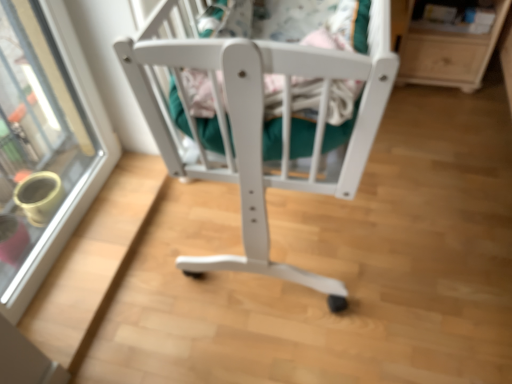
Question: Is transparent glass door at upper left inside or outside of white wood crib at center?

Choices:
 (A) outside
 (B) inside

Answer: (A)

Question: Considering the positions of transparent glass door at upper left and white wood crib at center in the image, is transparent glass door at upper left taller or shorter than white wood crib at center?

Choices:
 (A) tall
 (B) short

Answer: (A)

Question: Estimate the real-world distances between objects in this image. Which object is closer to the white wood crib at center?

Choices:
 (A) light wood/texture shelf at upper right
 (B) transparent glass door at upper left

Answer: (B)

Question: Considering the real-world distances, which object is farthest from the white wood crib at center?

Choices:
 (A) light wood/texture shelf at upper right
 (B) transparent glass door at upper left

Answer: (A)